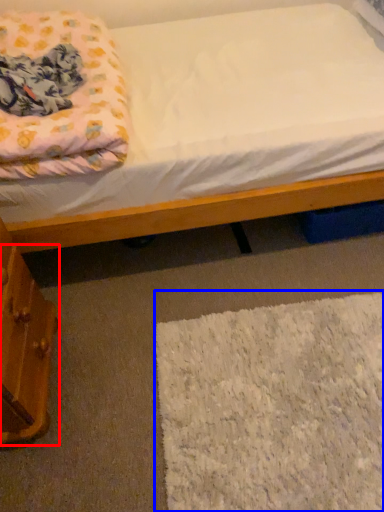
Question: Which object appears farthest to the camera in this image, drawer (highlighted by a red box) or mat (highlighted by a blue box)?

Choices:
 (A) drawer
 (B) mat

Answer: (B)